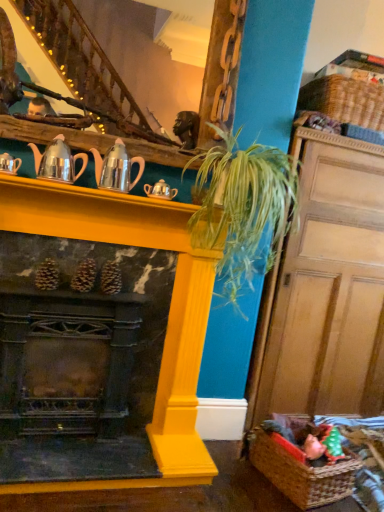
I want to click on free space above yellow painted wood fireplace at center (from a real-world perspective), so click(110, 203).